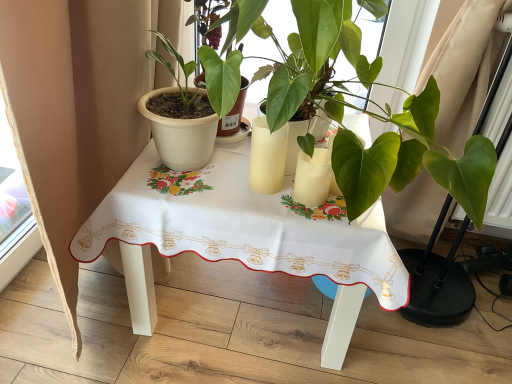
This screenshot has height=384, width=512. What are the coordinates of `free space in front of matte yellow glass at center, placed as the 1th candle holder when sorted from left to right` in the screenshot? It's located at (263, 204).